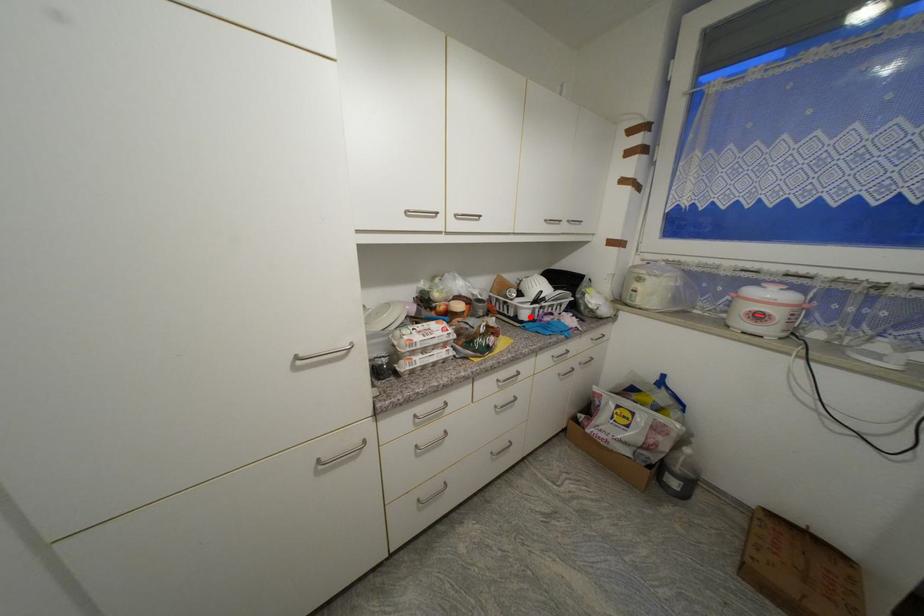
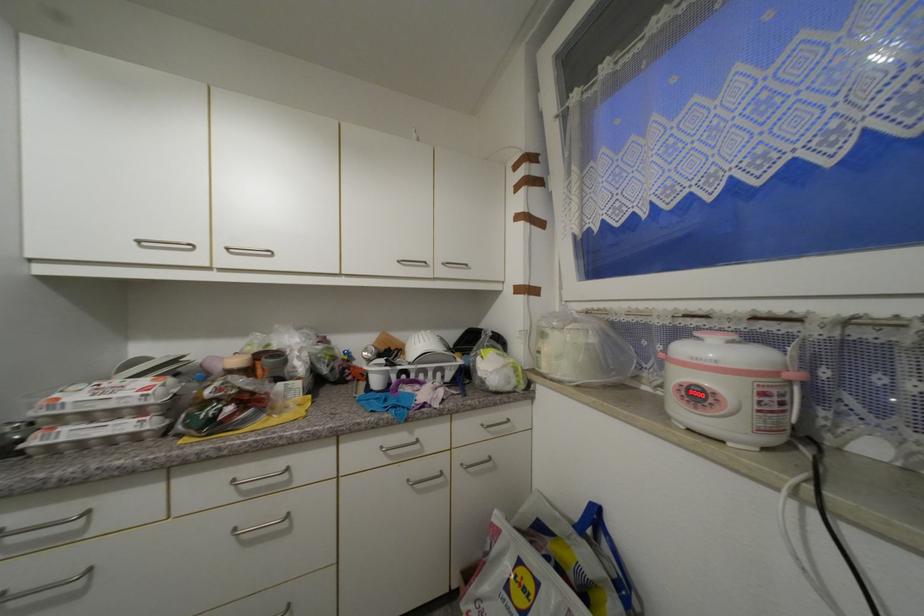
Locate, in the second image, the point that corresponds to the highlighted location in the first image.

(382, 384)